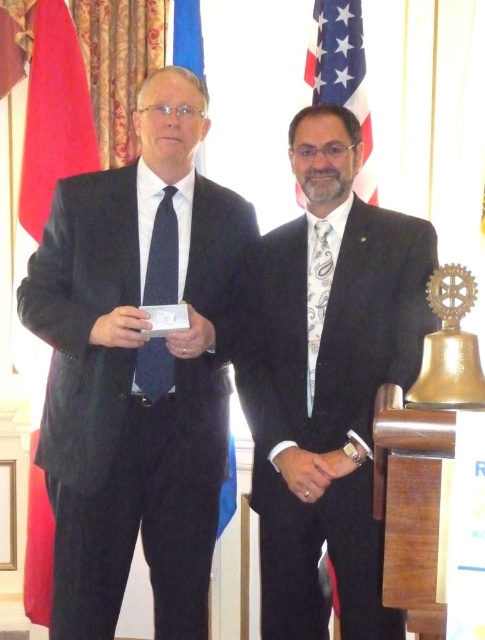
Question: Is red fabric flag at left smaller than american flag at upper center?

Choices:
 (A) yes
 (B) no

Answer: (B)

Question: Can you confirm if matte black tie at left is positioned to the left of white paisley tie at center?

Choices:
 (A) yes
 (B) no

Answer: (A)

Question: Which point is farther from the camera taking this photo?

Choices:
 (A) (313, 339)
 (B) (253, 355)
 (C) (323, 90)

Answer: (C)

Question: Estimate the real-world distances between objects in this image. Which object is closer to the blue fabric flag at upper center?

Choices:
 (A) red fabric flag at left
 (B) matte black suit at center
 (C) matte black tie at left
 (D) american flag at upper center

Answer: (D)

Question: Is red fabric flag at left positioned behind blue fabric flag at upper center?

Choices:
 (A) yes
 (B) no

Answer: (B)

Question: Which object is positioned farthest from the blue fabric flag at upper center?

Choices:
 (A) red fabric flag at left
 (B) white paisley tie at center
 (C) matte black suit at center
 (D) matte black suit at left

Answer: (C)